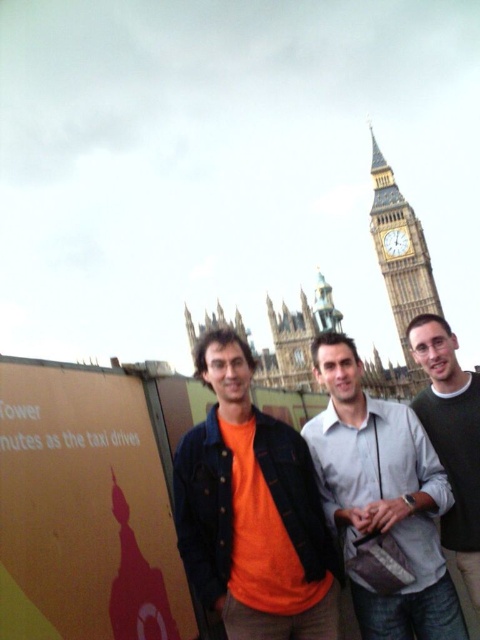
Question: Which point appears closest to the camera in this image?

Choices:
 (A) (225, 458)
 (B) (386, 276)

Answer: (A)

Question: Is orange matte shirt at center closer to camera compared to golden stone clock tower at upper right?

Choices:
 (A) yes
 (B) no

Answer: (A)

Question: Which point is closer to the camera?

Choices:
 (A) golden stone clock tower at upper right
 (B) orange matte shirt at center

Answer: (B)

Question: Does orange matte shirt at center come behind light gray shirt at center?

Choices:
 (A) yes
 (B) no

Answer: (B)

Question: Which point is farther to the camera?

Choices:
 (A) golden stone clock tower at upper right
 (B) orange matte shirt at center

Answer: (A)

Question: Is green sweater at center above golden stone clock tower at upper right?

Choices:
 (A) yes
 (B) no

Answer: (B)